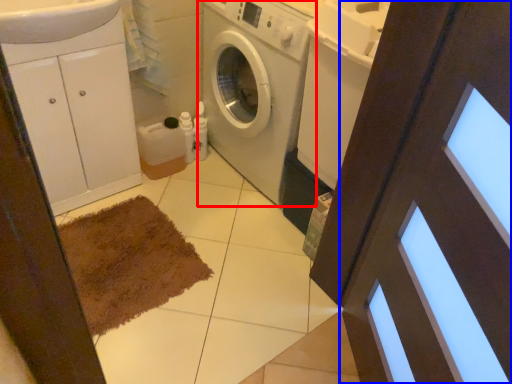
Question: Which object is further to the camera taking this photo, washing machine (highlighted by a red box) or screen door (highlighted by a blue box)?

Choices:
 (A) washing machine
 (B) screen door

Answer: (A)